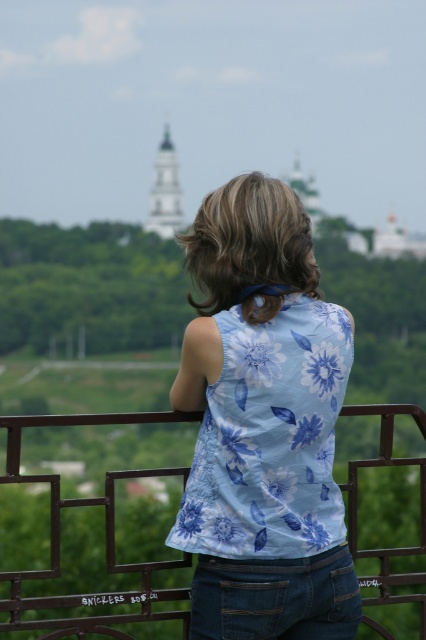
You are a drone operator tasked with capturing a photo of the light blue floral tank top at center and the metallic brown railing at center from above. The camera has a maximum focus range of 30 meters. Will the drone be able to capture both objects clearly in the same photo?

The distance between the light blue floral tank top at center and the metallic brown railing at center is 27.24 meters, which is within the camera maximum focus range of 30 meters. Therefore, the drone can capture both objects clearly in the same photo.

You are standing at the edge of the railing and want to know how far you are from the point marked as point (244, 236). Can you determine the distance?

The distance between you and point (244, 236) is 126.83 meters.

You are a fashion designer observing the person in the image. You need to determine which clothing item, the light blue floral tank top at center or the denim at center, would require more fabric to produce. Based on the visual evidence, which one would need more material?

The light blue floral tank top at center is larger in size than the denim at center, so it would require more fabric to produce.